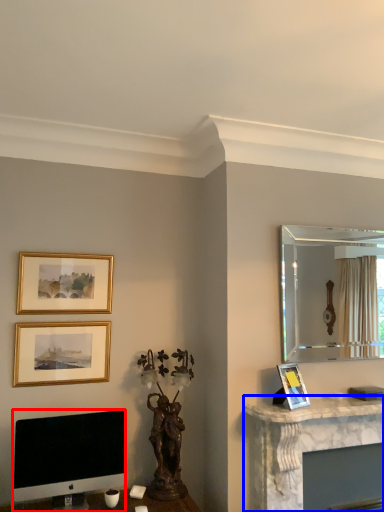
Question: Which of the following is the closest to the observer, computer monitor (highlighted by a red box) or computer desk (highlighted by a blue box)?

Choices:
 (A) computer monitor
 (B) computer desk

Answer: (A)